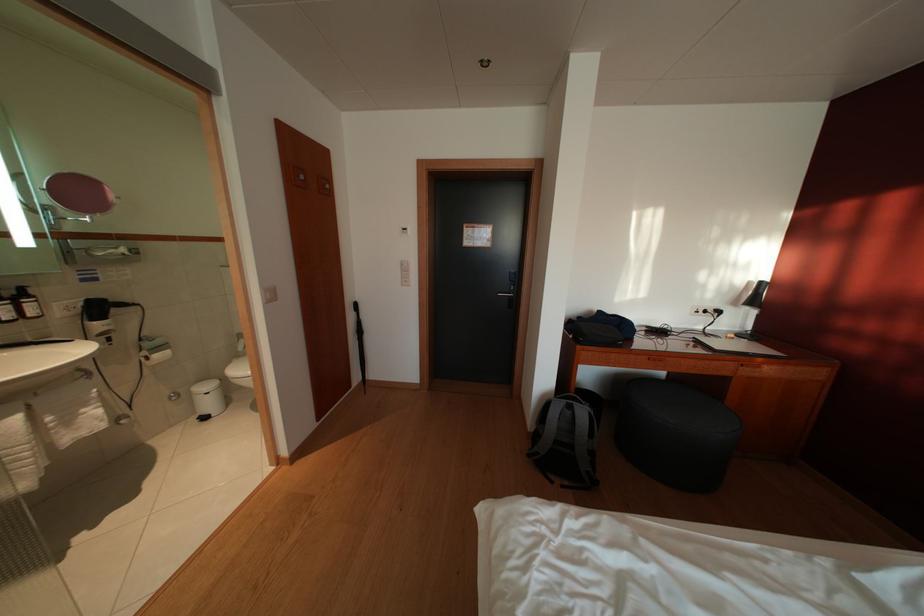
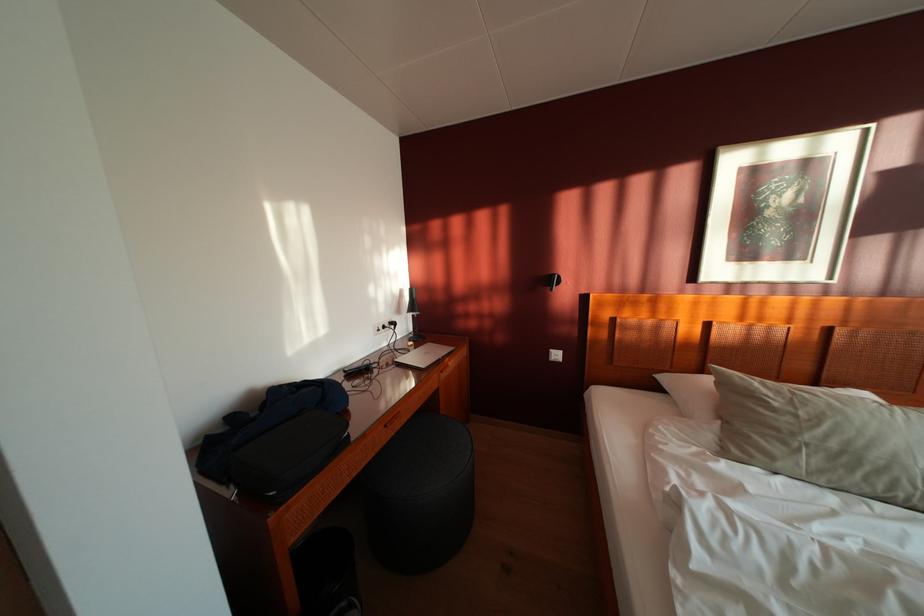
In the second image, find the point that corresponds to point 678,376 in the first image.

(412, 424)